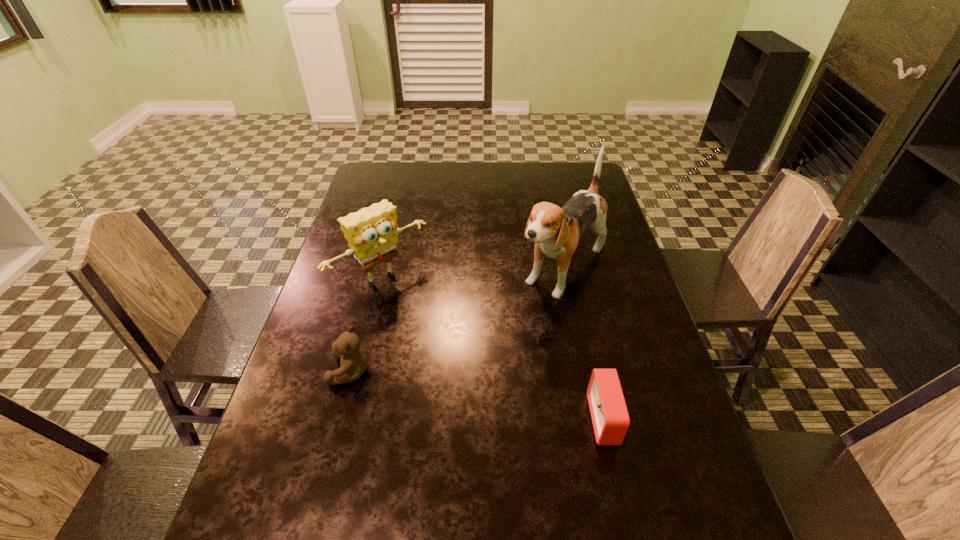
This screenshot has width=960, height=540. In order to click on free space located at the face of the puppy in this screenshot , I will do `click(473, 376)`.

Locate an element on the screen. The image size is (960, 540). vacant area situated 0.120m at the face of the puppy is located at coordinates (516, 329).

Identify the location of vacant region located 0.120m at the face of the puppy. The width and height of the screenshot is (960, 540). (516, 329).

Identify the location of blank area located on the face of the sponge. (420, 313).

Locate an element on the screen. vacant region located on the face of the sponge is located at coordinates (433, 326).

Locate an element on the screen. This screenshot has height=540, width=960. free space located on the face of the sponge is located at coordinates (453, 347).

At what (x,y) coordinates should I click in order to perform the action: click on teddy bear located in the left edge section of the desktop. Please return your answer as a coordinate pair (x, y). The height and width of the screenshot is (540, 960). Looking at the image, I should click on (353, 362).

At what (x,y) coordinates should I click in order to perform the action: click on sponge that is positioned at the left edge. Please return your answer as a coordinate pair (x, y). Looking at the image, I should click on (371, 232).

The width and height of the screenshot is (960, 540). I want to click on alarm clock located in the right edge section of the desktop, so click(x=609, y=414).

Identify the location of puppy at the right edge. The image size is (960, 540). (556, 231).